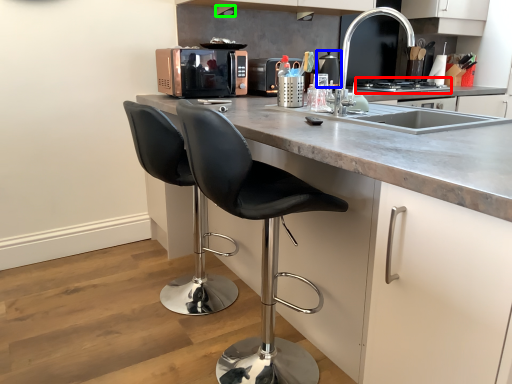
Question: Based on their relative distances, which object is nearer to stove (highlighted by a red box)? Choose from appliance (highlighted by a blue box) and exhaust hood (highlighted by a green box).

Choices:
 (A) appliance
 (B) exhaust hood

Answer: (A)